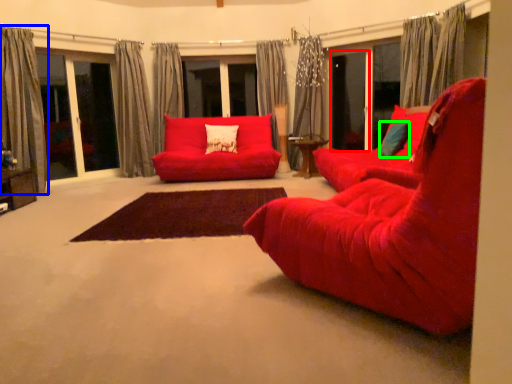
Question: Based on their relative distances, which object is nearer to screen door (highlighted by a red box)? Choose from curtain (highlighted by a blue box) and pillow (highlighted by a green box).

Choices:
 (A) curtain
 (B) pillow

Answer: (B)